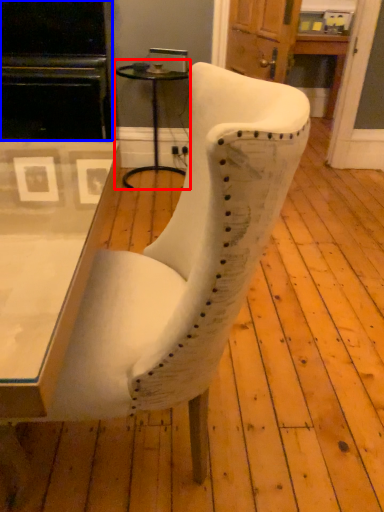
Question: Which point is closer to the camera, side table (highlighted by a red box) or entertainment center (highlighted by a blue box)?

Choices:
 (A) side table
 (B) entertainment center

Answer: (B)